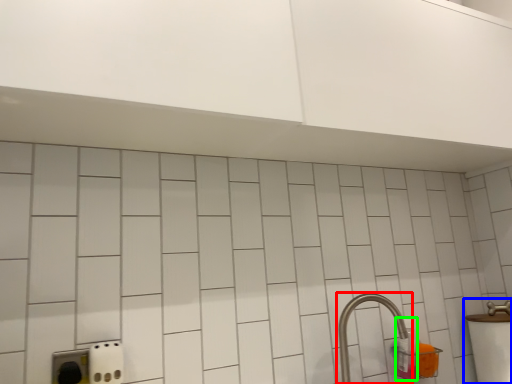
Question: Estimate the real-world distances between objects in this image. Which object is farther from tap (highlighted by a red box), sink (highlighted by a blue box) or bottle (highlighted by a green box)?

Choices:
 (A) sink
 (B) bottle

Answer: (A)